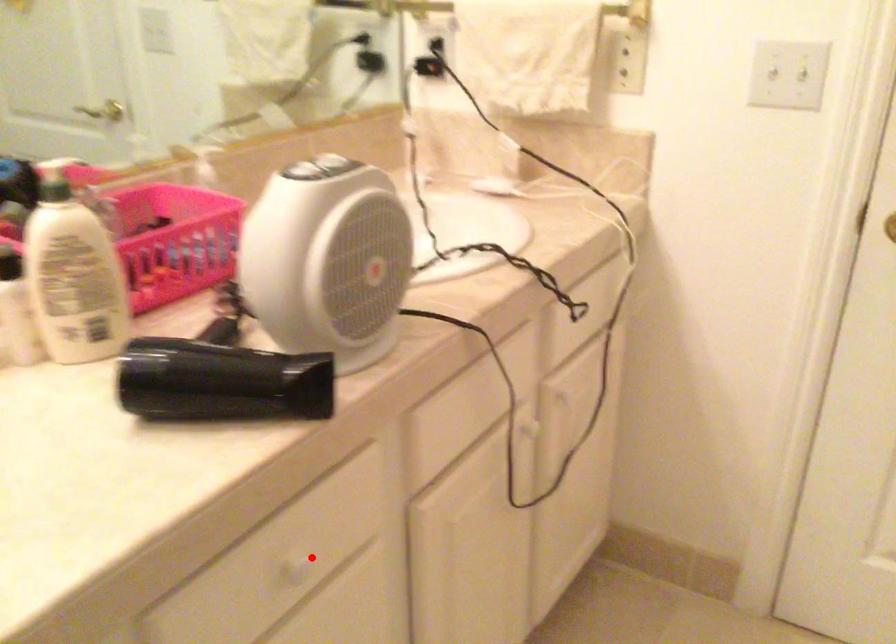
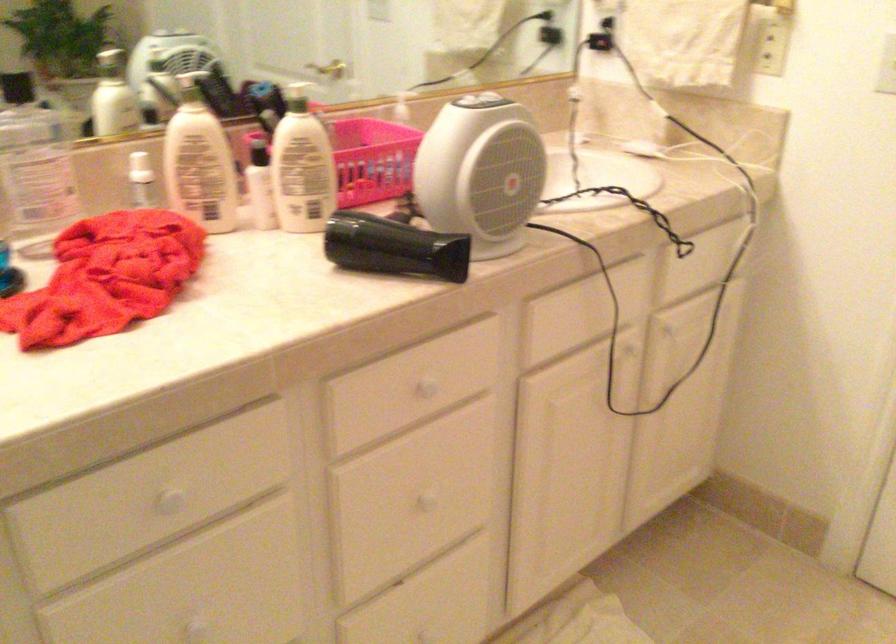
The point at the highlighted location is marked in the first image. Where is the corresponding point in the second image?

(426, 386)